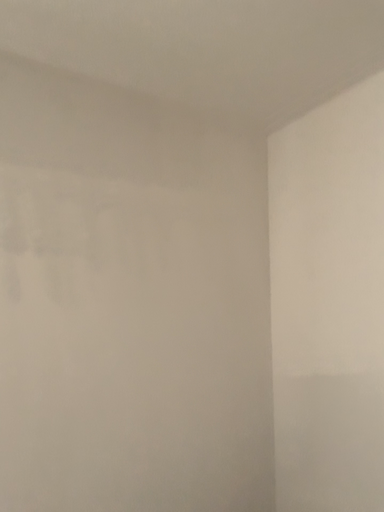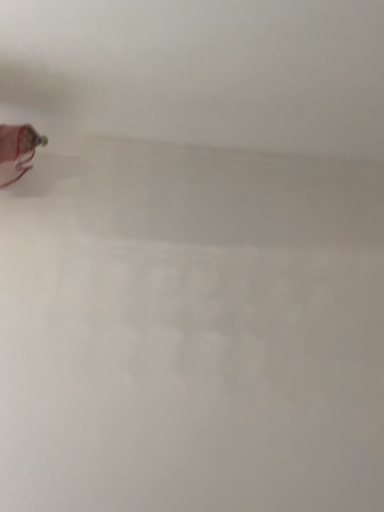
Question: How did the camera likely rotate when shooting the video?

Choices:
 (A) rotated upward
 (B) rotated downward

Answer: (A)